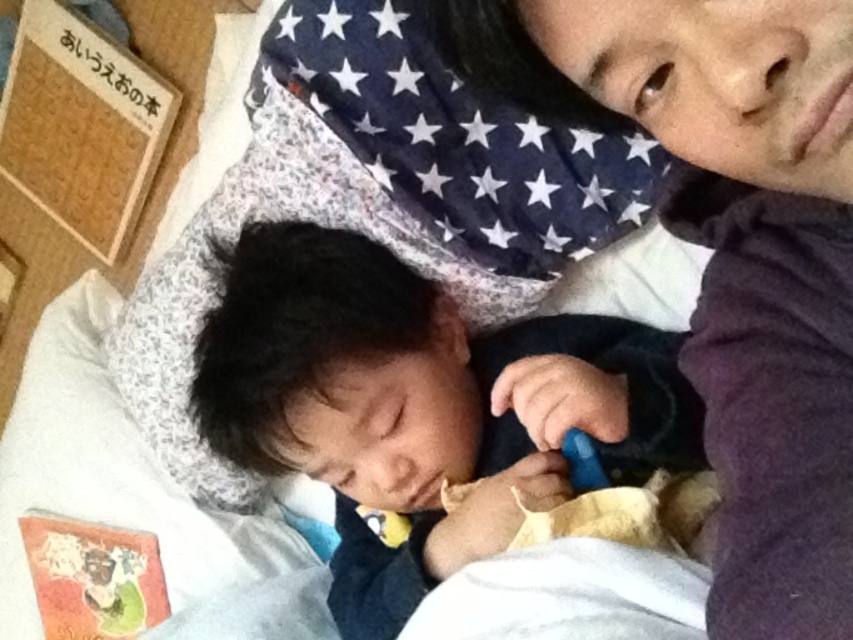
Question: Is purple soft fabric at upper right bigger than black soft baby at center?

Choices:
 (A) no
 (B) yes

Answer: (A)

Question: Which point appears farthest from the camera in this image?

Choices:
 (A) (798, 540)
 (B) (460, 531)

Answer: (B)

Question: From the image, what is the correct spatial relationship of purple soft fabric at upper right in relation to black soft baby at center?

Choices:
 (A) right
 (B) left

Answer: (A)

Question: Considering the relative positions of purple soft fabric at upper right and black soft baby at center in the image provided, where is purple soft fabric at upper right located with respect to black soft baby at center?

Choices:
 (A) above
 (B) below

Answer: (A)

Question: Which point is closer to the camera taking this photo?

Choices:
 (A) (389, 481)
 (B) (722, 256)

Answer: (B)